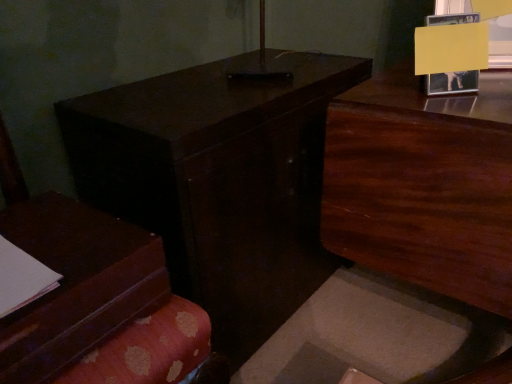
This screenshot has height=384, width=512. What are the coordinates of `matte brown book at left` in the screenshot? It's located at (97, 302).

Where is `matte brown book at left`? matte brown book at left is located at coordinates (97, 302).

What's the angular difference between dark wood dresser at upper right and dark wood table at center's facing directions?

They differ by 90.7 degrees in their facing directions.

Considering the positions of objects dark wood dresser at upper right and dark wood table at center in the image provided, who is more to the left, dark wood dresser at upper right or dark wood table at center?

dark wood table at center.

Where is `table below the dark wood dresser at upper right (from a real-world perspective)`? This screenshot has height=384, width=512. table below the dark wood dresser at upper right (from a real-world perspective) is located at coordinates (219, 180).

Which object is wider, dark wood dresser at upper right or dark wood table at center?

Wider between the two is dark wood dresser at upper right.

From the picture: Considering the relative sizes of dark wood table at center and dark wood dresser at upper right in the image provided, is dark wood table at center taller than dark wood dresser at upper right?

No, dark wood table at center is not taller than dark wood dresser at upper right.

Is dark wood dresser at upper right at the back of dark wood table at center?

No, dark wood table at center is not facing the opposite direction of dark wood dresser at upper right.

Between dark wood table at center and dark wood dresser at upper right, which one appears on the right side from the viewer's perspective?

From the viewer's perspective, dark wood dresser at upper right appears more on the right side.

Which of these two, dark wood table at center or matte brown book at left, is smaller?

matte brown book at left.

Considering the relative positions of dark wood table at center and matte brown book at left in the image provided, is dark wood table at center to the left or to the right of matte brown book at left?

dark wood table at center is positioned on matte brown book at left's right side.

Between point (112, 155) and point (64, 347), which one is positioned behind?

The point (112, 155) is behind.

Is point (67, 333) farther from camera compared to point (454, 210)?

That is False.

Is matte brown book at left wider or thinner than dark wood dresser at upper right?

Considering their sizes, matte brown book at left looks slimmer than dark wood dresser at upper right.

Can you tell me how much matte brown book at left and dark wood dresser at upper right differ in facing direction?

The angular difference between matte brown book at left and dark wood dresser at upper right is 89.7 degrees.

Which object is closer to the camera, matte brown book at left or dark wood dresser at upper right?

matte brown book at left is closer to the camera.

Is matte brown book at left positioned far away from dark wood table at center?

They are positioned close to each other.

Is matte brown book at left aimed at dark wood table at center?

No.

Can you confirm if matte brown book at left is shorter than dark wood table at center?

Yes, matte brown book at left is shorter than dark wood table at center.

From a real-world perspective, is matte brown book at left physically located above or below dark wood table at center?

matte brown book at left is situated higher than dark wood table at center in the real world.

Would you say dark wood dresser at upper right is a long distance from matte brown book at left?

No, dark wood dresser at upper right is not far away from matte brown book at left.

Which is more distant, (498,179) or (39,336)?

The point (498,179) is behind.

From a real-world perspective, which object stands above the other?

From a 3D spatial view, matte brown book at left is above.

Which is behind, dark wood dresser at upper right or matte brown book at left?

Positioned behind is dark wood dresser at upper right.

Image resolution: width=512 pixels, height=384 pixels. I want to click on dresser positioned vertically above the dark wood table at center (from a real-world perspective), so click(x=423, y=185).

You are a GUI agent. You are given a task and a screenshot of the screen. Output one action in this format:
    pyautogui.click(x=<x>, y=<y>)
    Task: Click on the dresser below the dark wood table at center (from the image's perspective)
    
    Given the screenshot: What is the action you would take?
    pyautogui.click(x=423, y=185)

From the image, which object appears to be farther from matte brown book at left, dark wood dresser at upper right or dark wood table at center?

dark wood dresser at upper right is positioned further to the anchor matte brown book at left.

Looking at the image, which one is located further to dark wood dresser at upper right, matte brown book at left or dark wood table at center?

Based on the image, matte brown book at left appears to be further to dark wood dresser at upper right.

Looking at the image, which one is located further to dark wood table at center, matte brown book at left or dark wood dresser at upper right?

The object further to dark wood table at center is dark wood dresser at upper right.

Estimate the real-world distances between objects in this image. Which object is further from dark wood dresser at upper right, dark wood table at center or matte brown book at left?

matte brown book at left is positioned further to the anchor dark wood dresser at upper right.

Estimate the real-world distances between objects in this image. Which object is further from matte brown book at left, dark wood table at center or dark wood dresser at upper right?

Based on the image, dark wood dresser at upper right appears to be further to matte brown book at left.

Estimate the real-world distances between objects in this image. Which object is further from dark wood table at center, dark wood dresser at upper right or matte brown book at left?

dark wood dresser at upper right is further to dark wood table at center.

The height and width of the screenshot is (384, 512). I want to click on table between matte brown book at left and dark wood dresser at upper right, so click(219, 180).